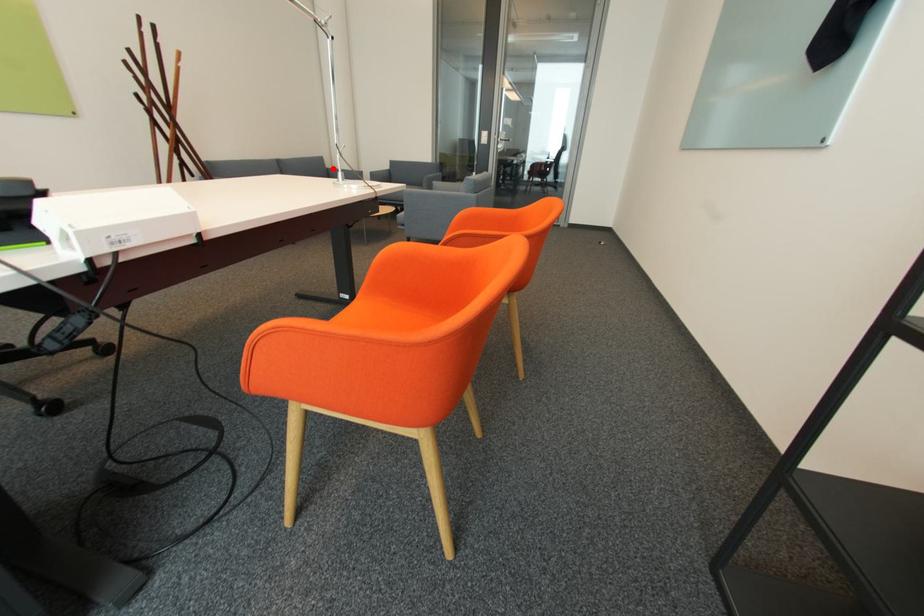
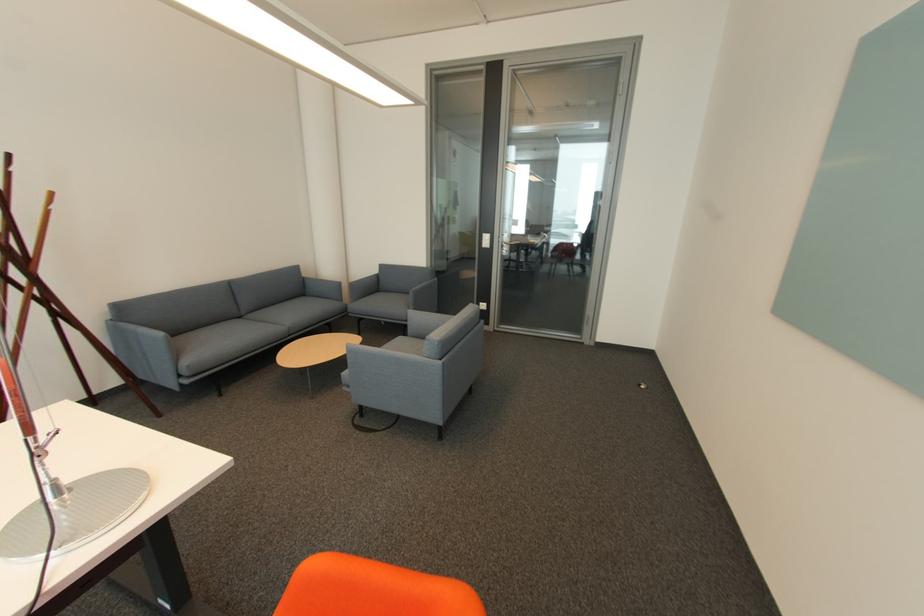
Locate, in the second image, the point that corresponds to the highlighted location in the first image.

(310, 278)